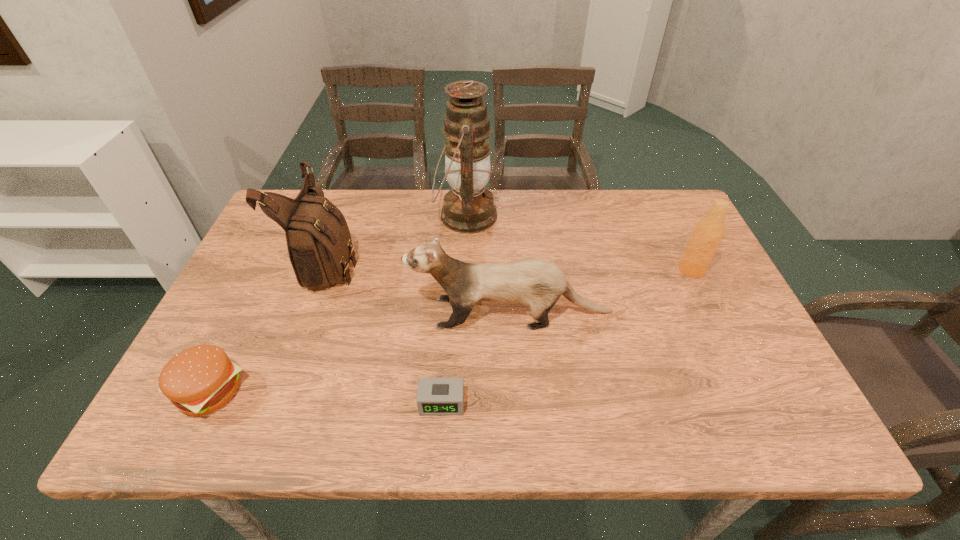
Identify the location of free area in between the second tallest object and the alarm clock. (385, 332).

Identify the location of vacant point located between the fifth shortest object and the lantern. (397, 239).

What are the coordinates of `empty space that is in between the tallest object and the shoulder bag` in the screenshot? It's located at (397, 239).

Find the location of a particular element. Image resolution: width=960 pixels, height=540 pixels. free spot between the tallest object and the beer bottle is located at coordinates (579, 243).

The height and width of the screenshot is (540, 960). Identify the location of free area in between the shortest object and the shoulder bag. (385, 332).

Identify which object is the fourth closest to the lantern. Please provide its 2D coordinates. Your answer should be formatted as a tuple, i.e. [(x, y)], where the tuple contains the x and y coordinates of a point satisfying the conditions above.

[(708, 233)]

Locate an element on the screen. This screenshot has width=960, height=540. the third closest object to the second tallest object is located at coordinates pos(468,208).

The image size is (960, 540). In order to click on free space in the image that satisfies the following two spatial constraints: 1. on the face of the ferret; 2. on the front-facing side of the alarm clock in this screenshot , I will do `click(516, 403)`.

Locate an element on the screen. The image size is (960, 540). vacant area that satisfies the following two spatial constraints: 1. on the back side of the hamburger; 2. on the left side of the beer bottle is located at coordinates (269, 270).

This screenshot has height=540, width=960. In order to click on free region that satisfies the following two spatial constraints: 1. on the front-facing side of the shoulder bag; 2. on the back side of the beer bottle in this screenshot , I will do `click(325, 270)`.